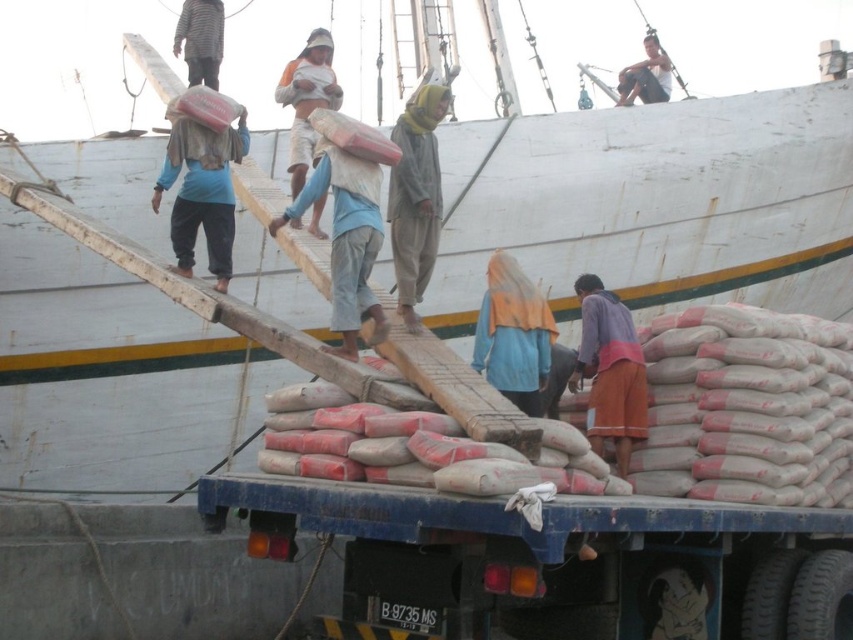
You are a worker on the dock and need to place a new item between the light blue fabric bag at center and the matte blue shirt at center. Based on their sizes, which object should be placed closer to the taller one?

The light blue fabric bag at center is taller than the matte blue shirt at center, so the new item should be placed closer to the light blue fabric bag at center.

You are observing workers at the dock and notice two headscarves worn by the workers. Which headscarf is taller between the yellow fabric headscarf at center and the blue fabric headscarf at center?

The yellow fabric headscarf at center is taller than the blue fabric headscarf at center according to the description.

You are a safety inspector observing the loading process at the dock. You notice two workers wearing a blue fabric headscarf at center and a striped fabric shirt at upper left. According to safety protocols, workers must maintain a minimum distance of 1 meter between each other to prevent accidents. Can you determine if they are complying with this requirement based on their positions?

The blue fabric headscarf at center is positioned on the right side of striped fabric shirt at upper left, but the distance between them isn not specified in the objects description. Therefore, it is impossible to determine if they are maintaining the required 1 meter distance.